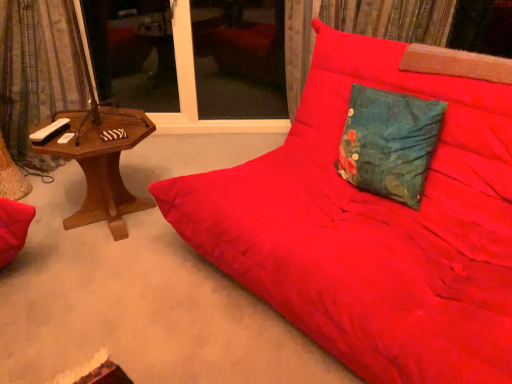
Where is `vacant space situated on the left part of matte red fabric studio couch at center`? The image size is (512, 384). vacant space situated on the left part of matte red fabric studio couch at center is located at coordinates (121, 285).